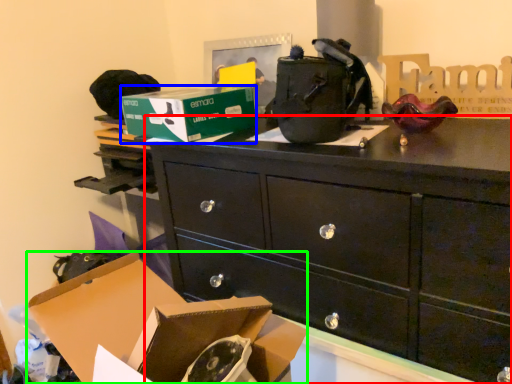
Question: Which object is positioned farthest from chest of drawers (highlighted by a red box)? Select from box (highlighted by a blue box) and box (highlighted by a green box).

Choices:
 (A) box
 (B) box

Answer: (B)